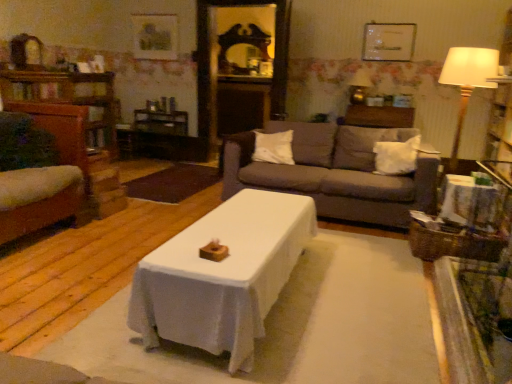
Question: Is wooden mirror at upper center next to matte white picture frame at upper center, which is counted as the first picture frame, starting from the front?

Choices:
 (A) yes
 (B) no

Answer: (B)

Question: Is wooden mirror at upper center looking in the opposite direction of matte white picture frame at upper center, the 2th picture frame when ordered from back to front?

Choices:
 (A) yes
 (B) no

Answer: (B)

Question: Is wooden mirror at upper center surrounding matte white picture frame at upper center, the 2th picture frame when ordered from left to right?

Choices:
 (A) yes
 (B) no

Answer: (B)

Question: Is wooden mirror at upper center outside of matte white picture frame at upper center, which ranks as the 1th picture frame in right-to-left order?

Choices:
 (A) yes
 (B) no

Answer: (A)

Question: From a real-world perspective, is wooden mirror at upper center located higher than matte white picture frame at upper center, which ranks as the 1th picture frame in right-to-left order?

Choices:
 (A) yes
 (B) no

Answer: (A)

Question: Is wooden mirror at upper center thinner than matte white picture frame at upper center, which is counted as the first picture frame, starting from the front?

Choices:
 (A) no
 (B) yes

Answer: (A)

Question: Is white soft pillow at center, the second pillow positioned from the left, closer to the viewer compared to white soft pillow at center, which ranks as the first pillow in left-to-right order?

Choices:
 (A) no
 (B) yes

Answer: (B)

Question: Considering the relative sizes of white soft pillow at center, positioned as the 1th pillow in right-to-left order, and white soft pillow at center, which ranks as the first pillow in left-to-right order, in the image provided, is white soft pillow at center, positioned as the 1th pillow in right-to-left order, thinner than white soft pillow at center, which ranks as the first pillow in left-to-right order,?

Choices:
 (A) no
 (B) yes

Answer: (A)

Question: Can you confirm if white soft pillow at center, positioned as the 1th pillow in right-to-left order, is shorter than white soft pillow at center, which ranks as the first pillow in left-to-right order?

Choices:
 (A) no
 (B) yes

Answer: (A)

Question: Considering the relative sizes of white soft pillow at center, positioned as the 1th pillow in right-to-left order, and white soft pillow at center, which ranks as the first pillow in left-to-right order, in the image provided, is white soft pillow at center, positioned as the 1th pillow in right-to-left order, bigger than white soft pillow at center, which ranks as the first pillow in left-to-right order,?

Choices:
 (A) yes
 (B) no

Answer: (A)

Question: Is white soft pillow at center, positioned as the 1th pillow in right-to-left order, far away from white soft pillow at center, which ranks as the first pillow in left-to-right order?

Choices:
 (A) no
 (B) yes

Answer: (A)

Question: From a real-world perspective, is white soft pillow at center, positioned as the 1th pillow in right-to-left order, over white soft pillow at center, which ranks as the first pillow in left-to-right order?

Choices:
 (A) no
 (B) yes

Answer: (A)

Question: Is the position of wooden side table at right less distant than that of matte gold lamp at upper right?

Choices:
 (A) yes
 (B) no

Answer: (A)